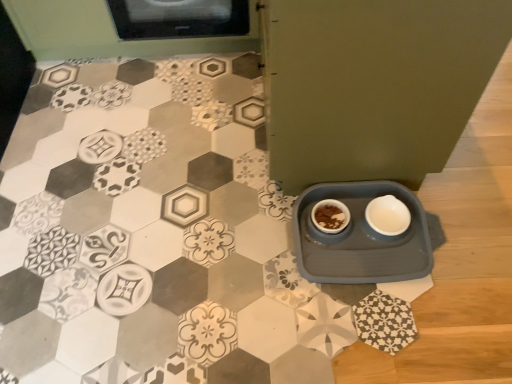
The height and width of the screenshot is (384, 512). I want to click on brown matte bowl at center, so click(330, 216).

This screenshot has width=512, height=384. I want to click on brown matte bowl at center, so click(x=330, y=216).

Is gray plastic tray at lower right next to white matte bowl at lower right and touching it?

No, gray plastic tray at lower right is not making contact with white matte bowl at lower right.

Is gray plastic tray at lower right taller than white matte bowl at lower right?

Yes, gray plastic tray at lower right is taller than white matte bowl at lower right.

Which object is further away from the camera, gray plastic tray at lower right or white matte bowl at lower right?

white matte bowl at lower right.

From the image's perspective, between gray plastic tray at lower right and white matte bowl at lower right, which one is located above?

From the image's view, white matte bowl at lower right is above.

Locate an element on the screen. This screenshot has height=384, width=512. coffee cup above the gray plastic tray at lower right (from the image's perspective) is located at coordinates (330, 216).

How many degrees apart are the facing directions of brown matte bowl at center and gray plastic tray at lower right?

brown matte bowl at center and gray plastic tray at lower right are facing 0.000134 degrees away from each other.

Which point is more distant from viewer, (336, 230) or (416, 200)?

The point (416, 200) is more distant.

Who is shorter, brown matte bowl at center or gray plastic tray at lower right?

brown matte bowl at center.

Is white matte bowl at lower right outside of brown matte bowl at center?

Yes, white matte bowl at lower right is not within brown matte bowl at center.

Could you tell me if white matte bowl at lower right is facing brown matte bowl at center?

No, white matte bowl at lower right does not turn towards brown matte bowl at center.

From a real-world perspective, which object stands above the other?

brown matte bowl at center.

Who is taller, white matte bowl at lower right or brown matte bowl at center?

Standing taller between the two is brown matte bowl at center.

Does gray plastic tray at lower right appear on the left side of brown matte bowl at center?

No.

Is gray plastic tray at lower right turned away from brown matte bowl at center?

Yes, gray plastic tray at lower right's orientation is away from brown matte bowl at center.

What's the angular difference between gray plastic tray at lower right and brown matte bowl at center's facing directions?

There is a 0.000134-degree angle between the facing directions of gray plastic tray at lower right and brown matte bowl at center.

Is gray plastic tray at lower right in front of or behind brown matte bowl at center in the image?

gray plastic tray at lower right is positioned closer to the viewer than brown matte bowl at center.

Considering their positions, is brown matte bowl at center located in front of or behind white matte bowl at lower right?

brown matte bowl at center is behind white matte bowl at lower right.

From the image's perspective, is brown matte bowl at center located beneath white matte bowl at lower right?

Yes, from the image's perspective, brown matte bowl at center is beneath white matte bowl at lower right.

Is brown matte bowl at center facing away from white matte bowl at lower right?

No, brown matte bowl at center is not facing the opposite direction of white matte bowl at lower right.

Which of these two, white matte bowl at lower right or gray plastic tray at lower right, is wider?

Wider between the two is gray plastic tray at lower right.

Between white matte bowl at lower right and gray plastic tray at lower right, which one has larger size?

gray plastic tray at lower right is bigger.

Measure the distance between white matte bowl at lower right and gray plastic tray at lower right.

They are 4.61 inches apart.

Which is more distant, (369, 221) or (369, 259)?

Positioned behind is point (369, 221).

Where is `tableware on the right of gray plastic tray at lower right`? This screenshot has width=512, height=384. tableware on the right of gray plastic tray at lower right is located at coordinates (388, 215).

The width and height of the screenshot is (512, 384). In order to click on table below the brown matte bowl at center (from a real-world perspective) in this screenshot , I will do `click(360, 238)`.

From the image, which object appears to be farther from white matte bowl at lower right, brown matte bowl at center or gray plastic tray at lower right?

The object further to white matte bowl at lower right is brown matte bowl at center.

From the image, which object appears to be nearer to gray plastic tray at lower right, brown matte bowl at center or white matte bowl at lower right?

The object closer to gray plastic tray at lower right is white matte bowl at lower right.

Based on their spatial positions, is gray plastic tray at lower right or brown matte bowl at center closer to white matte bowl at lower right?

The object closer to white matte bowl at lower right is gray plastic tray at lower right.

From the image, which object appears to be nearer to brown matte bowl at center, gray plastic tray at lower right or white matte bowl at lower right?

gray plastic tray at lower right lies closer to brown matte bowl at center than the other object.

Estimate the real-world distances between objects in this image. Which object is closer to brown matte bowl at center, white matte bowl at lower right or gray plastic tray at lower right?

Based on the image, gray plastic tray at lower right appears to be nearer to brown matte bowl at center.

Estimate the real-world distances between objects in this image. Which object is closer to gray plastic tray at lower right, white matte bowl at lower right or brown matte bowl at center?

The object closer to gray plastic tray at lower right is white matte bowl at lower right.

Find the location of a particular element. The width and height of the screenshot is (512, 384). table between brown matte bowl at center and white matte bowl at lower right is located at coordinates (360, 238).